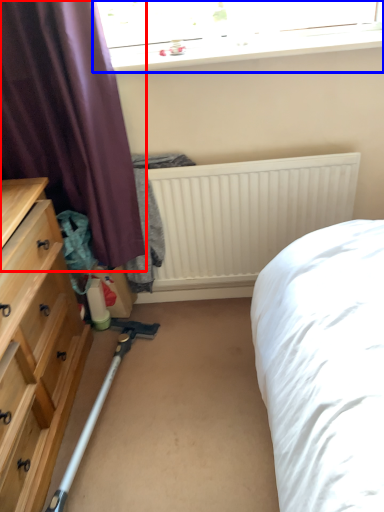
Question: Which of the following is the farthest to the observer, curtain (highlighted by a red box) or window (highlighted by a blue box)?

Choices:
 (A) curtain
 (B) window

Answer: (B)